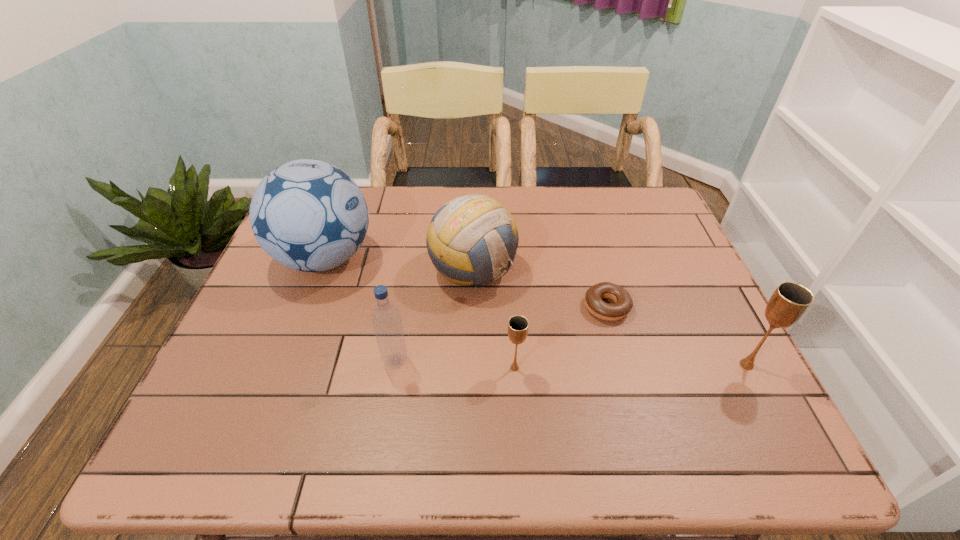
Where is `vacant point located between the second shortest object and the soccer ball`? The height and width of the screenshot is (540, 960). vacant point located between the second shortest object and the soccer ball is located at coordinates (420, 313).

Where is `vacant space that's between the rightmost object and the fifth tallest object`? vacant space that's between the rightmost object and the fifth tallest object is located at coordinates (631, 366).

The image size is (960, 540). What are the coordinates of `vacant area that lies between the volleyball and the shortest object` in the screenshot? It's located at (540, 288).

I want to click on free space between the volleyball and the left chalice, so click(x=493, y=319).

Where is `vacant point located between the volleyball and the tallest object`? The height and width of the screenshot is (540, 960). vacant point located between the volleyball and the tallest object is located at coordinates (398, 264).

Locate an element on the screen. blank region between the fifth object from left to right and the fifth object from right to left is located at coordinates (501, 334).

Identify the location of free space between the water bottle and the rightmost object. (571, 363).

This screenshot has height=540, width=960. In order to click on object that is the closest to the shortest object in this screenshot , I will do `click(471, 240)`.

Where is `object identified as the third closest to the leftmost object`? Image resolution: width=960 pixels, height=540 pixels. object identified as the third closest to the leftmost object is located at coordinates (518, 325).

At what (x,y) coordinates should I click in order to perform the action: click on free space that satisfies the following two spatial constraints: 1. on the side with brand of the tallest object; 2. on the left side of the water bottle. Please return your answer as a coordinate pair (x, y). This screenshot has width=960, height=540. Looking at the image, I should click on pos(286,361).